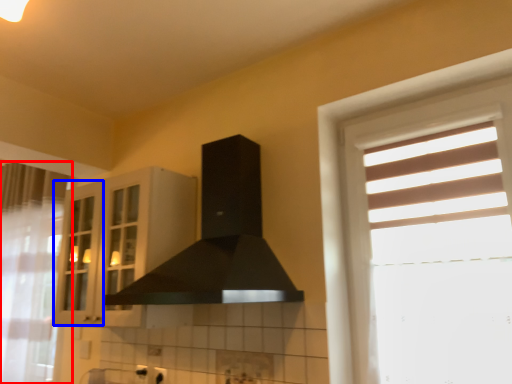
Question: Which point is further to the camera, curtain (highlighted by a red box) or screen door (highlighted by a blue box)?

Choices:
 (A) curtain
 (B) screen door

Answer: (B)